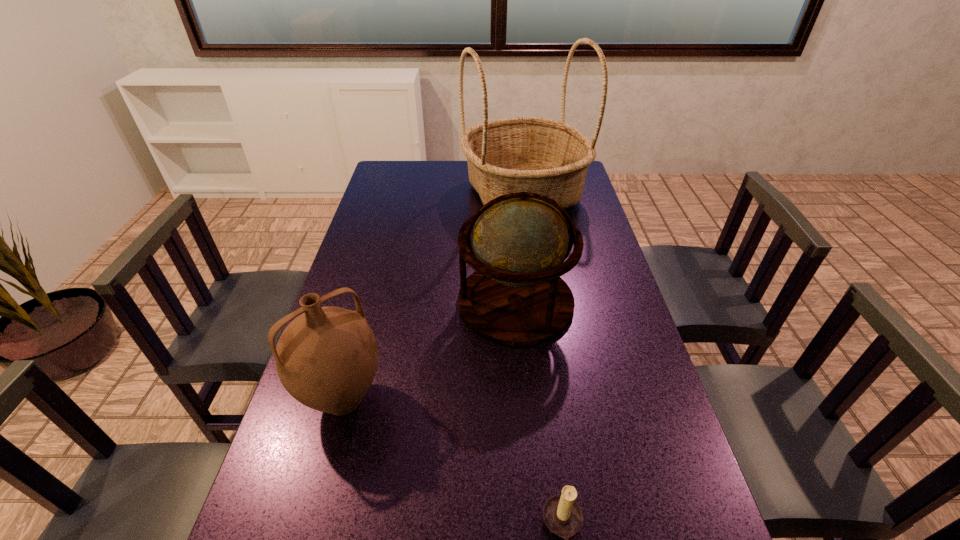
The height and width of the screenshot is (540, 960). I want to click on empty space between the pitcher and the farthest object, so click(x=433, y=296).

Locate which object ranks third in proximity to the tallest object. Please provide its 2D coordinates. Your answer should be formatted as a tuple, i.e. [(x, y)], where the tuple contains the x and y coordinates of a point satisfying the conditions above.

[(563, 516)]

Locate an element on the screen. The height and width of the screenshot is (540, 960). object that can be found as the third closest to the tallest object is located at coordinates [x=563, y=516].